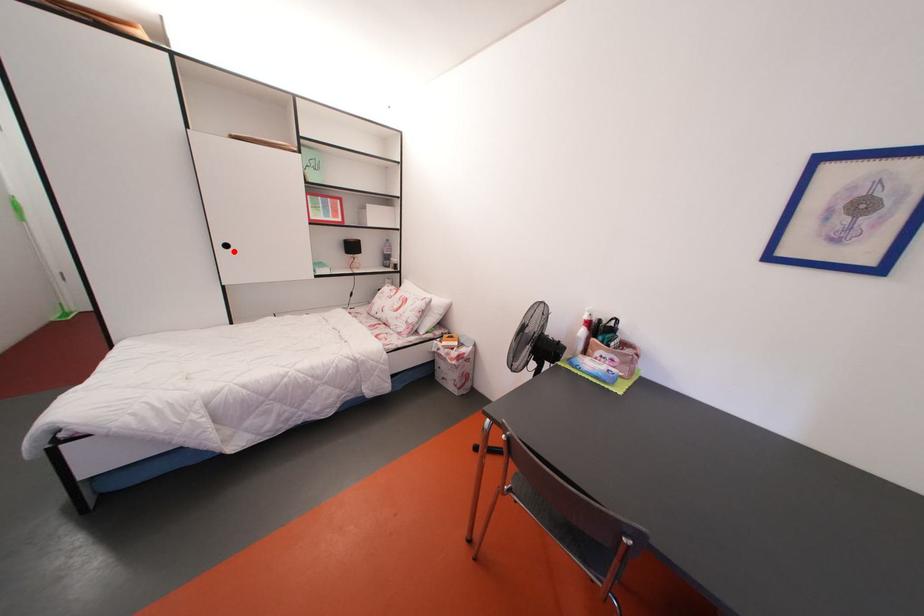
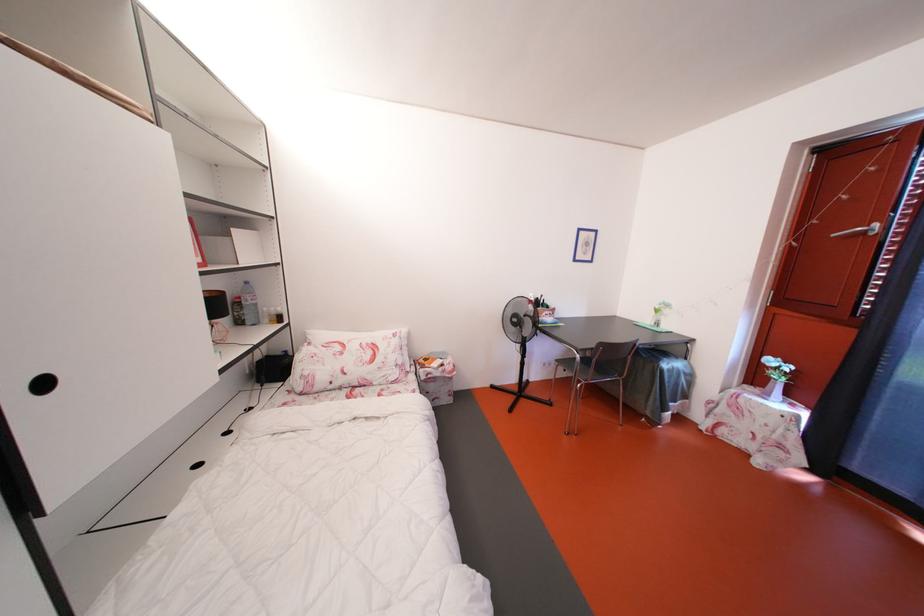
Question: I am providing you with two images of the same scene from different viewpoints. A red point is marked on the first image. At the location where the point appears in image 1, is it still visible in image 2?

Choices:
 (A) Yes
 (B) No

Answer: (A)